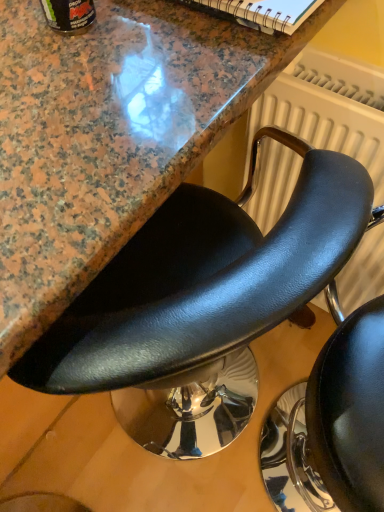
Question: In terms of size, does white textured radiator at upper right appear bigger or smaller than black leather chair at center, the 1th chair viewed from the right?

Choices:
 (A) small
 (B) big

Answer: (A)

Question: From a real-world perspective, is white textured radiator at upper right physically located above or below black leather chair at center, the 1th chair viewed from the right?

Choices:
 (A) below
 (B) above

Answer: (B)

Question: Which of these objects is positioned farthest from the black leather chair at center, arranged as the first chair when viewed from the left?

Choices:
 (A) white textured radiator at upper right
 (B) black leather chair at center, the 1th chair viewed from the right

Answer: (B)

Question: Estimate the real-world distances between objects in this image. Which object is closer to the black leather chair at center, arranged as the first chair when viewed from the left?

Choices:
 (A) white textured radiator at upper right
 (B) black leather chair at center, the 1th chair viewed from the right

Answer: (A)